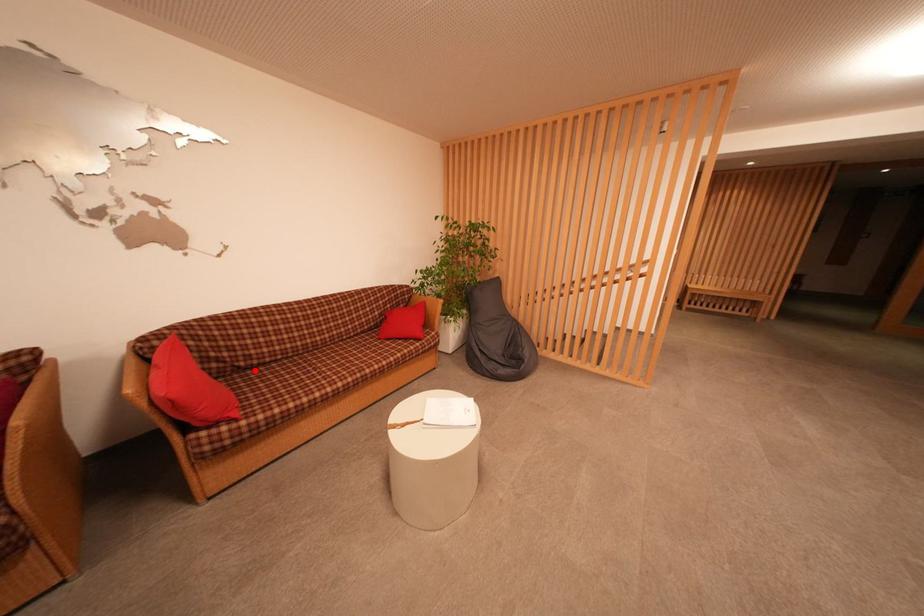
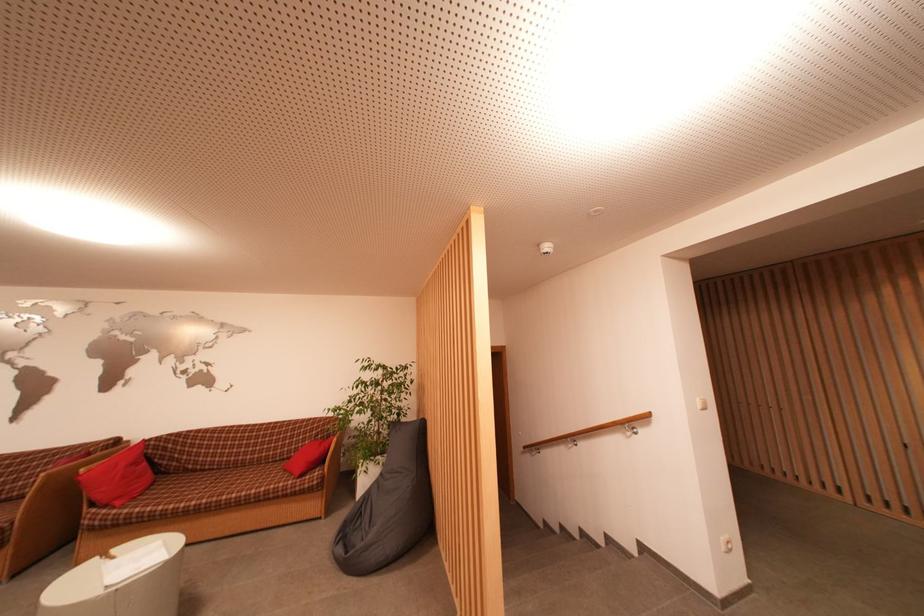
Where in the second image is the point corresponding to the highlighted location from the first image?

(198, 474)